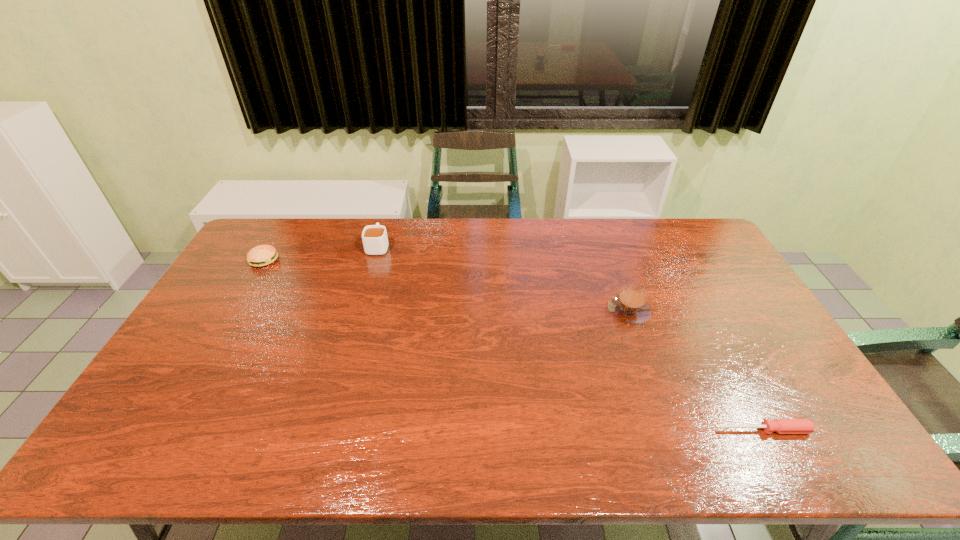
You are a GUI agent. You are given a task and a screenshot of the screen. Output one action in this format:
    pyautogui.click(x=<x>, y=<y>)
    Task: Click on the vacant area located on the right of the cappuccino
    The height and width of the screenshot is (540, 960).
    Given the screenshot: What is the action you would take?
    pyautogui.click(x=720, y=310)

This screenshot has height=540, width=960. Find the location of `vacant area located on the back of the patty`. vacant area located on the back of the patty is located at coordinates (276, 242).

This screenshot has height=540, width=960. What are the coordinates of `vacant point located 0.110m on the left of the rightmost object` in the screenshot? It's located at (673, 430).

I want to click on cup positioned at the far edge, so click(375, 241).

The width and height of the screenshot is (960, 540). What are the coordinates of `patty that is at the far edge` in the screenshot? It's located at (262, 255).

At what (x,y) coordinates should I click in order to perform the action: click on object present at the near edge. Please return your answer as a coordinate pair (x, y). This screenshot has width=960, height=540. Looking at the image, I should click on (782, 426).

The height and width of the screenshot is (540, 960). Identify the location of object located in the left edge section of the desktop. (262, 255).

The image size is (960, 540). In order to click on object at the right edge in this screenshot , I will do [782, 426].

Identify the location of object present at the far left corner. This screenshot has height=540, width=960. (262, 255).

The image size is (960, 540). In order to click on object at the near right corner in this screenshot , I will do `click(782, 426)`.